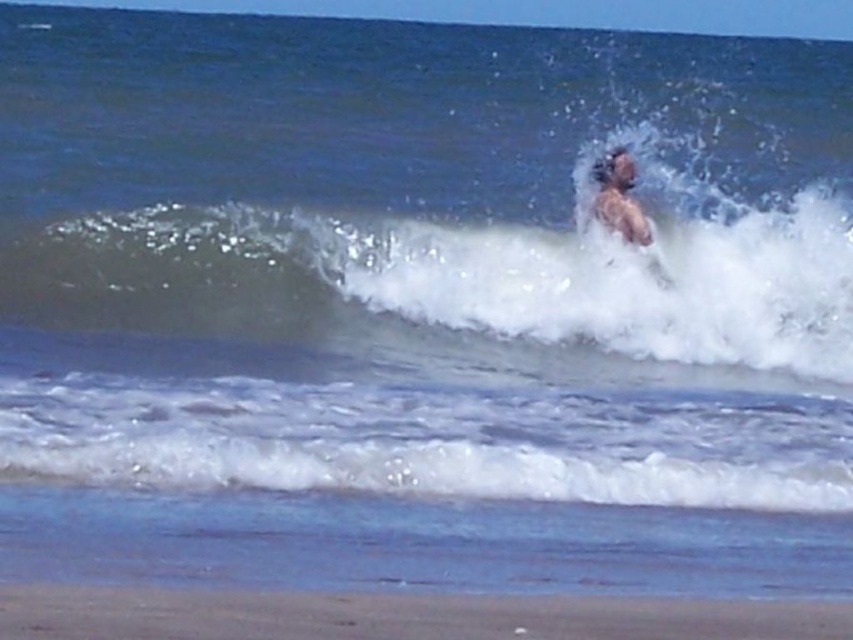
You are standing on the beach and want to take a photo of the smooth sand at lower center and the light brown hair at upper center. Which object should you focus on first if you want both to be in sharp focus?

You should focus on the light brown hair at upper center first because it is farther away from the viewer than the smooth sand at lower center, ensuring both are in focus when using depth of field.

You are standing on the beach and see two points marked on the sand. The first point is at coordinates point (x=753, y=323) and the second is at point (x=397, y=632). Which point is closer to you?

Point (x=397, y=632) is closer to you because point (x=753, y=323) is behind it.

You are a beachgoer who wants to build a sandcastle. You need a large area of sand to do so. Based on the scene, which area should you choose between the white frothy wave at upper center and the smooth sand at lower center?

The smooth sand at lower center is the better choice for building a sandcastle because it has a larger size compared to the white frothy wave at upper center.